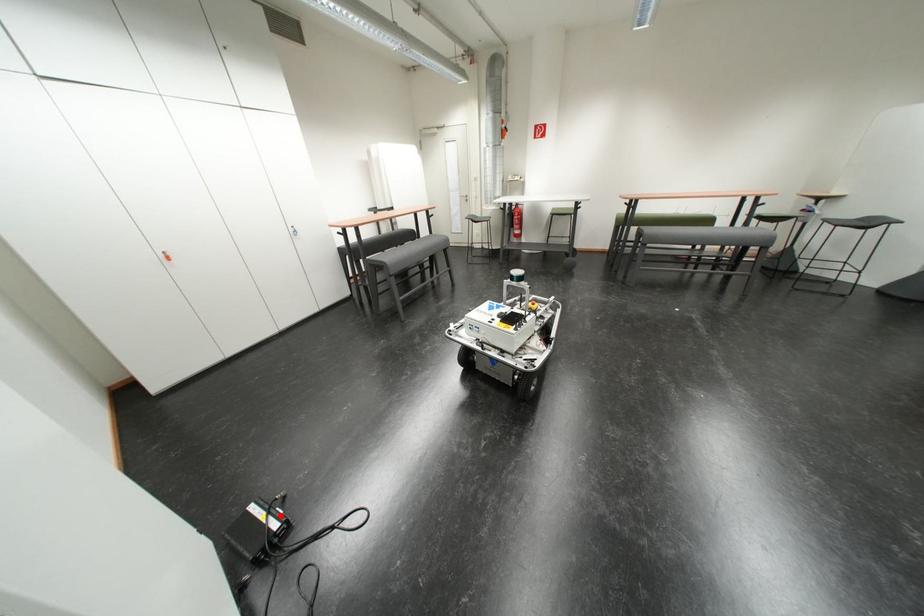
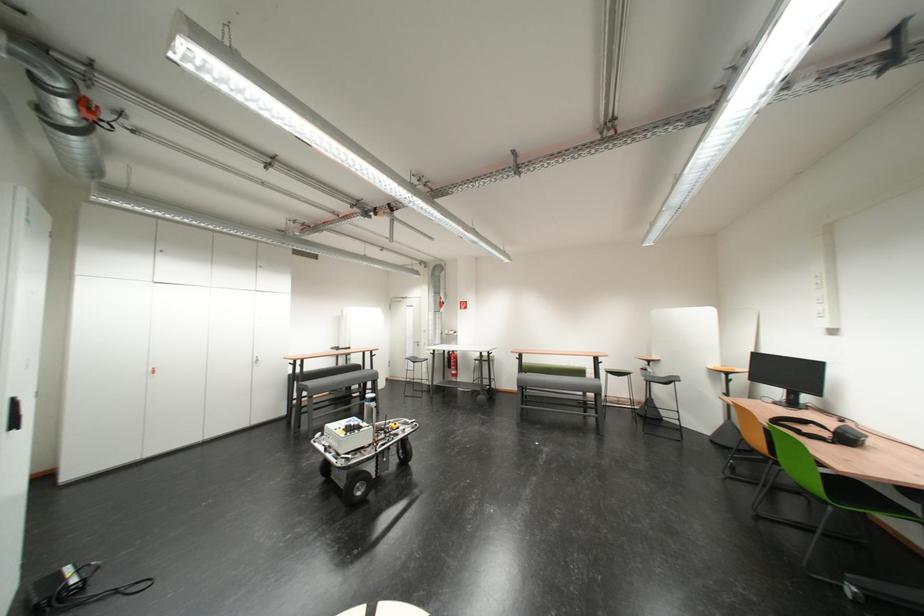
Question: I am providing you with two images of the same scene from different viewpoints. Image1 has a red point marked. In image2, the corresponding 3D location appears at what relative position? Reply with the corresponding letter.

Choices:
 (A) Closer
 (B) Farther

Answer: (B)